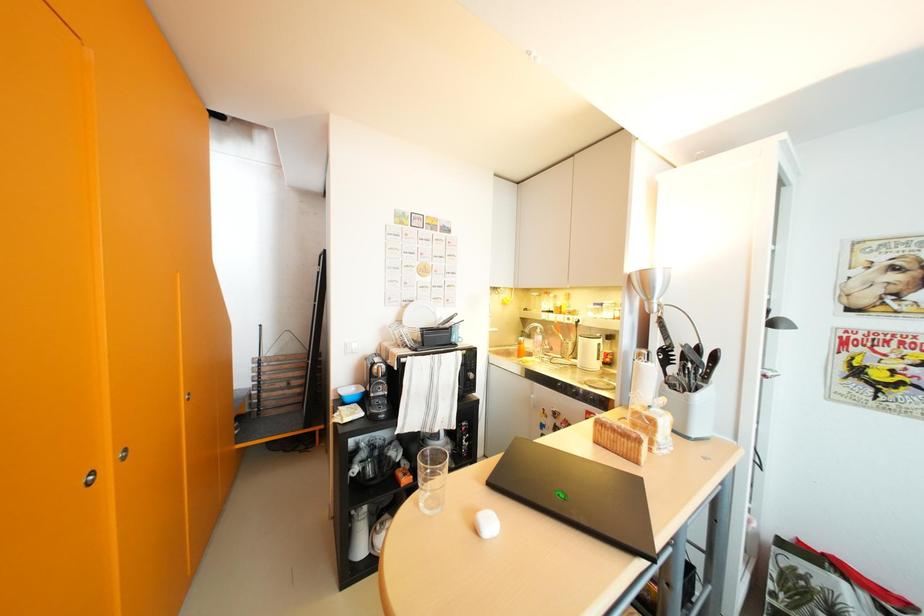
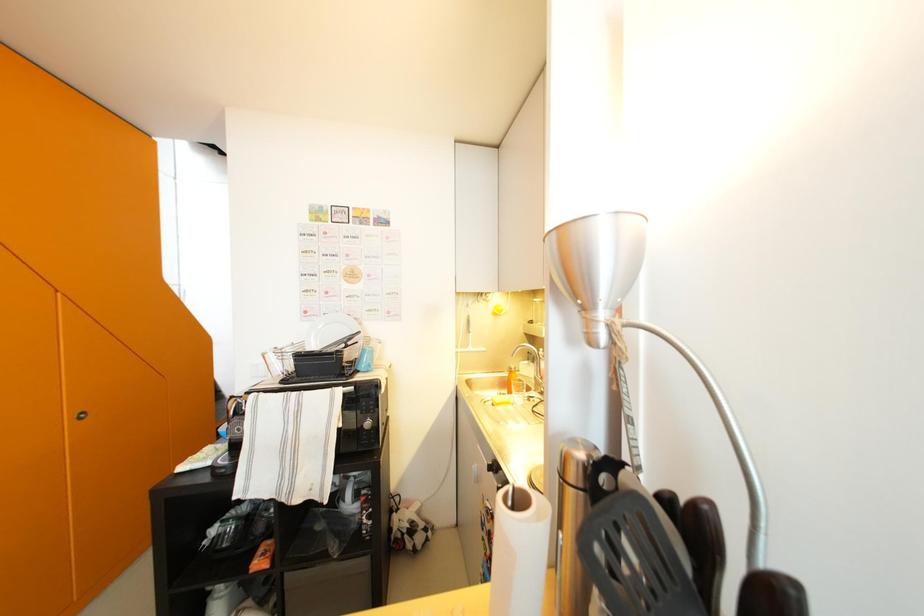
In a continuous first-person perspective shot, in which direction is the camera moving?

The cameraman moved toward right, forward.